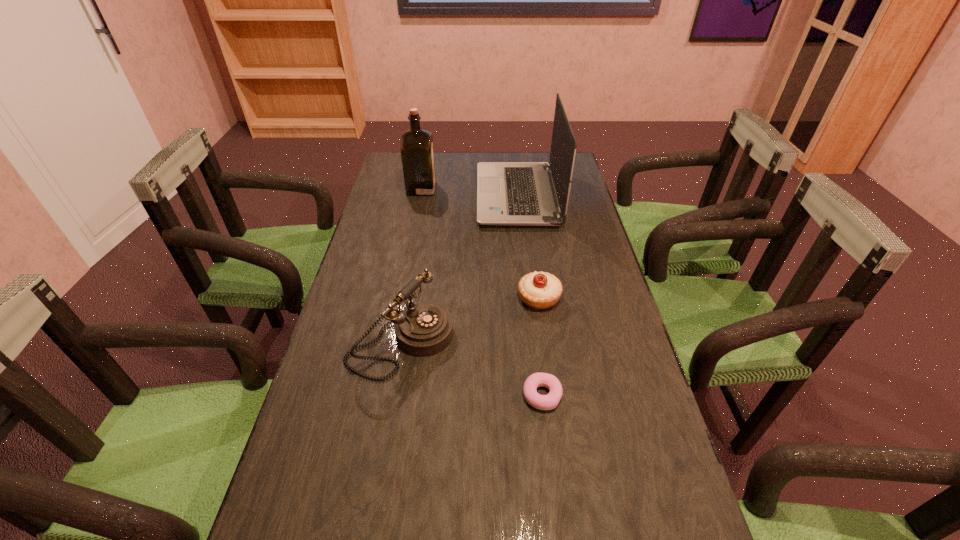
The height and width of the screenshot is (540, 960). What are the coordinates of `vacant area between the liquor and the nearer pastry` in the screenshot? It's located at (482, 292).

Identify the location of free space between the taller pastry and the shorter pastry. Image resolution: width=960 pixels, height=540 pixels. (540, 346).

Locate an element on the screen. Image resolution: width=960 pixels, height=540 pixels. unoccupied position between the taller pastry and the third shortest object is located at coordinates (470, 320).

Find the location of a particular element. vacant area that lies between the third tallest object and the nearer pastry is located at coordinates (471, 368).

Where is `empty space that is in between the telephone and the laptop computer`? empty space that is in between the telephone and the laptop computer is located at coordinates (459, 268).

You are a GUI agent. You are given a task and a screenshot of the screen. Output one action in this format:
    pyautogui.click(x=<x>, y=<y>)
    Task: Click on the object that is the second closest to the laptop computer
    
    Given the screenshot: What is the action you would take?
    pyautogui.click(x=539, y=290)

Select which object appears as the third closest to the third tallest object. Please provide its 2D coordinates. Your answer should be formatted as a tuple, i.e. [(x, y)], where the tuple contains the x and y coordinates of a point satisfying the conditions above.

[(508, 193)]

Where is `vacant space that satisfies the following two spatial constraints: 1. on the screen of the farther pastry; 2. on the left side of the laptop computer`? This screenshot has height=540, width=960. vacant space that satisfies the following two spatial constraints: 1. on the screen of the farther pastry; 2. on the left side of the laptop computer is located at coordinates (529, 298).

Identify the location of vacant space that satisfies the following two spatial constraints: 1. on the screen of the fourth tallest object; 2. on the left side of the laptop computer. This screenshot has height=540, width=960. (529, 298).

This screenshot has height=540, width=960. I want to click on vacant space that satisfies the following two spatial constraints: 1. on the label of the liquor; 2. on the back side of the farther pastry, so click(400, 298).